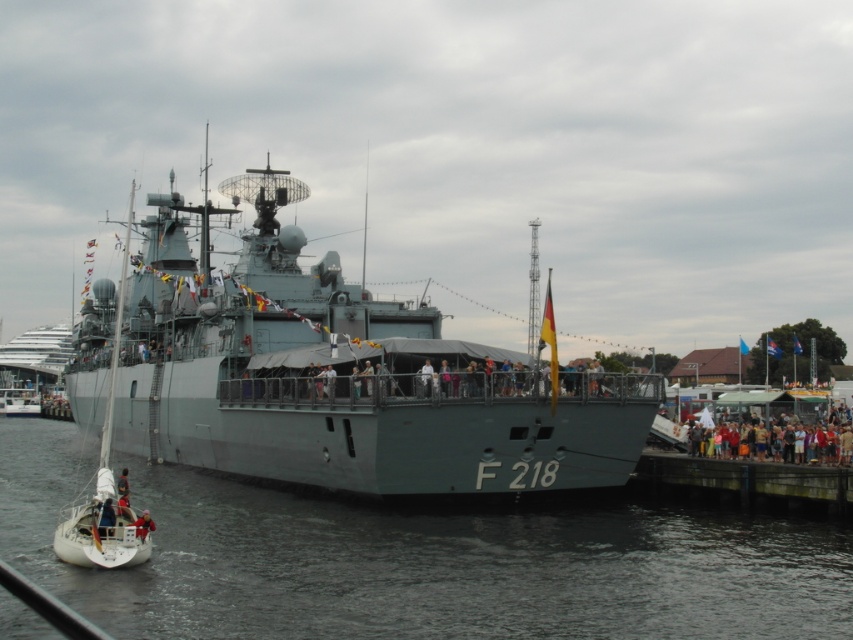
You are standing on the pier looking at the naval ship F 218. There are two points marked on the ship. The first point is at coordinates point (531,442) and the second point is at point (143,522). Which point appears closer to you?

Point (143,522) is closer to you because it is positioned closer to the camera than point (531,442).

You are a photographer planning to capture a wide shot of the naval ship. You need to ensure that both the gray water at center and the multicolored casual clothing at lower right are visible in the frame. Based on their sizes, which object should you prioritize positioning closer to the center of the photo to maintain clarity?

The gray water at center has a larger width than the multicolored casual clothing at lower right. To maintain clarity, prioritize positioning the gray water at center closer to the center of the photo since larger objects can be more impactful when centrally placed.

You are standing on the pier and see the gray water at center and the multicolored casual clothing at lower right. Which object is closer to you?

The gray water at center is closer to you because it is in front of the multicolored casual clothing at lower right.